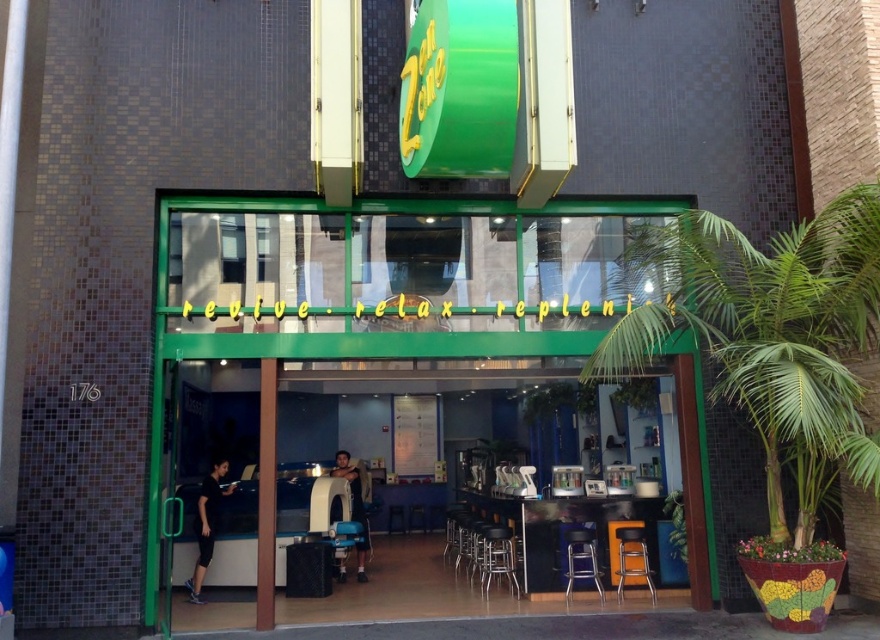
Question: Estimate the real-world distances between objects in this image. Which object is closer to the black glossy table at center?

Choices:
 (A) metallic gold bar stool at lower center
 (B) green matte signboard at center
 (C) black plastic door at center
 (D) metallic silver bar stool at center

Answer: (A)

Question: Which object is the farthest from the black glossy table at center?

Choices:
 (A) green matte signboard at center
 (B) metallic silver chair at center
 (C) metallic gold bar stool at lower center
 (D) black plastic door at center

Answer: (D)

Question: Can you confirm if black plastic door at center is bigger than metallic gold bar stool at lower center?

Choices:
 (A) no
 (B) yes

Answer: (B)

Question: Can you confirm if black glossy table at center is positioned to the right of metallic gold bar stool at lower center?

Choices:
 (A) no
 (B) yes

Answer: (A)

Question: Can you confirm if metallic gold bar stool at lower center is positioned below metallic silver chair at center?

Choices:
 (A) no
 (B) yes

Answer: (A)

Question: Which object is positioned closest to the metallic silver bar stool at center?

Choices:
 (A) metallic silver chair at center
 (B) metallic gold bar stool at lower center
 (C) black plastic door at center

Answer: (A)